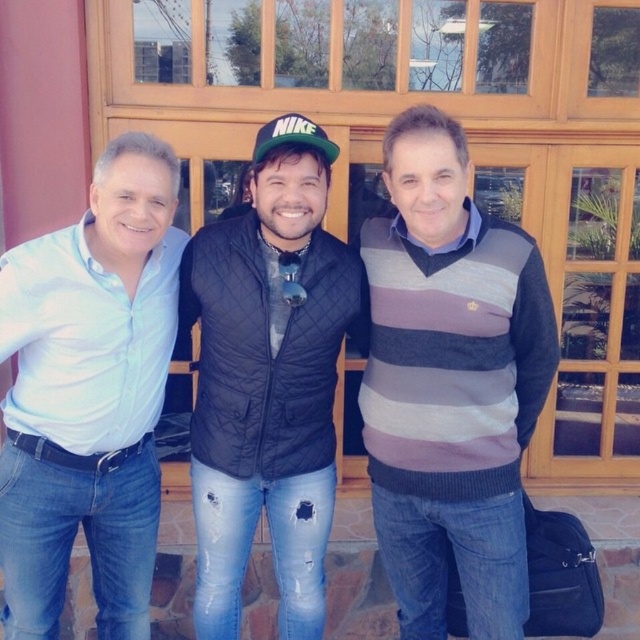
Question: Can you confirm if light blue cotton shirt at left is bigger than black quilted vest at center?

Choices:
 (A) yes
 (B) no

Answer: (A)

Question: Which point is closer to the camera?

Choices:
 (A) striped sweater at center
 (B) green matte baseball cap at center
 (C) black quilted vest at center
 (D) light blue cotton shirt at left

Answer: (D)

Question: Estimate the real-world distances between objects in this image. Which object is closer to the green matte baseball cap at center?

Choices:
 (A) striped sweater at center
 (B) black quilted vest at center
 (C) light blue cotton shirt at left

Answer: (B)

Question: Which object is closer to the camera taking this photo?

Choices:
 (A) striped sweater at center
 (B) green matte baseball cap at center
 (C) black quilted vest at center

Answer: (A)

Question: Is striped sweater at center below light blue cotton shirt at left?

Choices:
 (A) no
 (B) yes

Answer: (A)

Question: Can you confirm if striped sweater at center is bigger than green matte baseball cap at center?

Choices:
 (A) no
 (B) yes

Answer: (B)